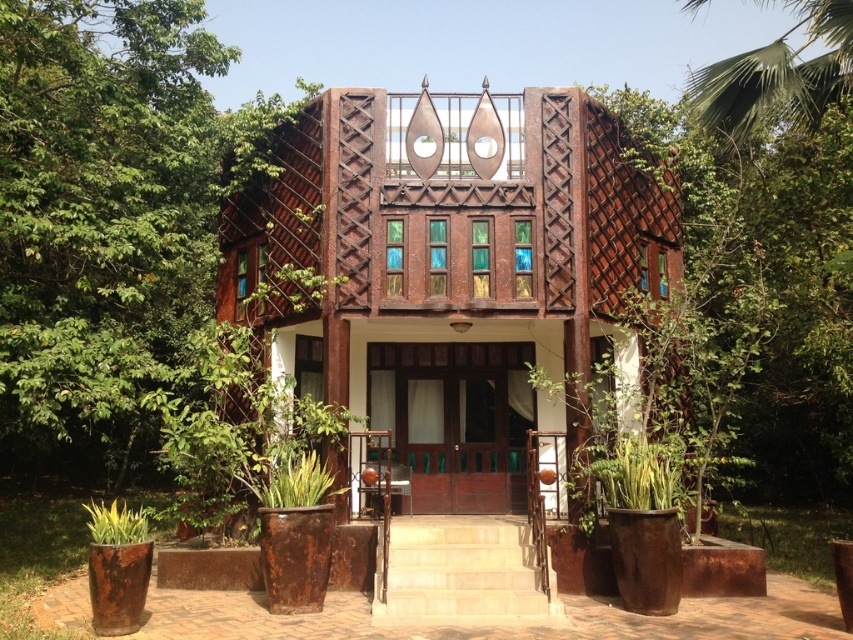
Question: Can you confirm if green leafy tree at left is wider than matte wood door at center?

Choices:
 (A) no
 (B) yes

Answer: (B)

Question: From the image, what is the correct spatial relationship of green leafy tree at left in relation to green leafy palm at upper right?

Choices:
 (A) below
 (B) above

Answer: (A)

Question: Does green leafy tree at left have a lesser width compared to green leafy palm at upper right?

Choices:
 (A) no
 (B) yes

Answer: (A)

Question: Which of the following is the farthest from the observer?

Choices:
 (A) (79, 262)
 (B) (515, 566)

Answer: (A)

Question: Among these objects, which one is farthest from the camera?

Choices:
 (A) green leafy palm at upper right
 (B) matte wood door at center
 (C) green leafy tree at left
 (D) green leafy plant at lower left

Answer: (A)

Question: Among these objects, which one is farthest from the camera?

Choices:
 (A) green leafy tree at left
 (B) green leafy plant at lower left

Answer: (A)